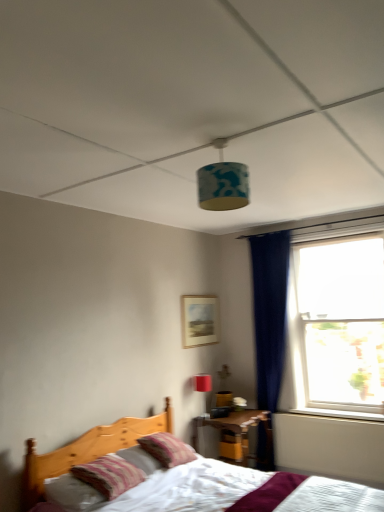
Locate an element on the screen. vacant space to the right of matte red table lamp at upper center is located at coordinates (219, 415).